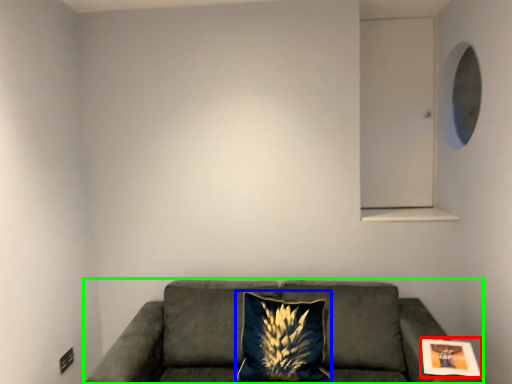
Question: Which object is the closest to the picture frame (highlighted by a red box)? Choose among these: pillow (highlighted by a blue box) or studio couch (highlighted by a green box).

Choices:
 (A) pillow
 (B) studio couch

Answer: (B)